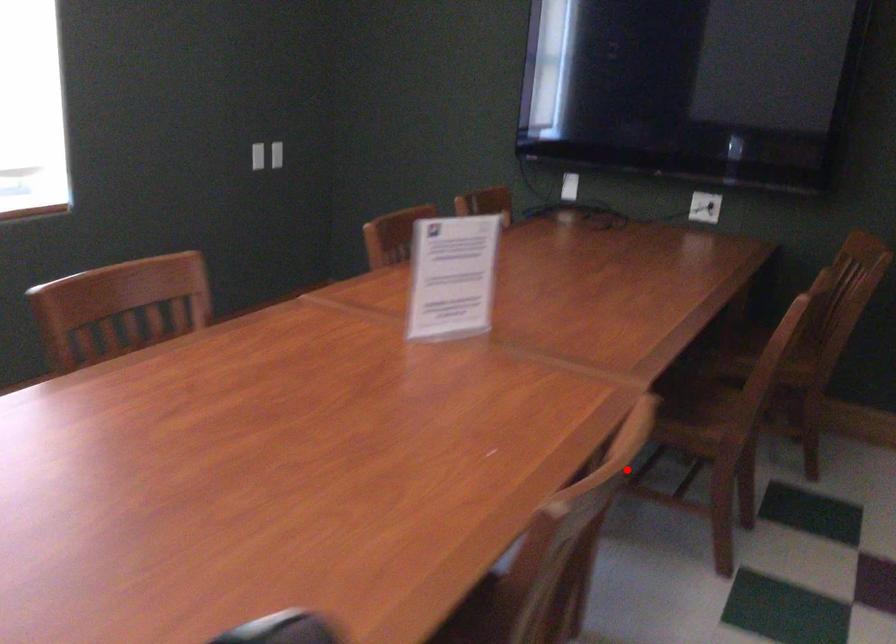
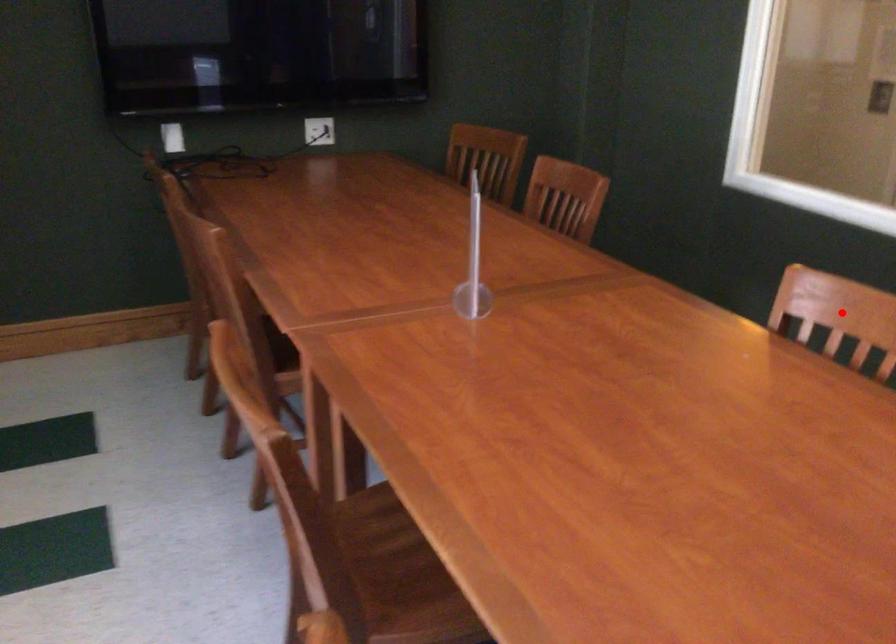
I am providing you with two images of the same scene from different viewpoints. A red point is marked on the first image and another point is marked on the second image. Is the marked point in image1 the same physical position as the marked point in image2?

Yes